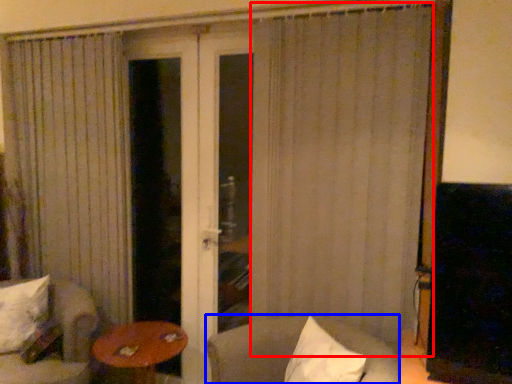
Question: Among these objects, which one is nearest to the camera, curtain (highlighted by a red box) or chair (highlighted by a blue box)?

Choices:
 (A) curtain
 (B) chair

Answer: (B)